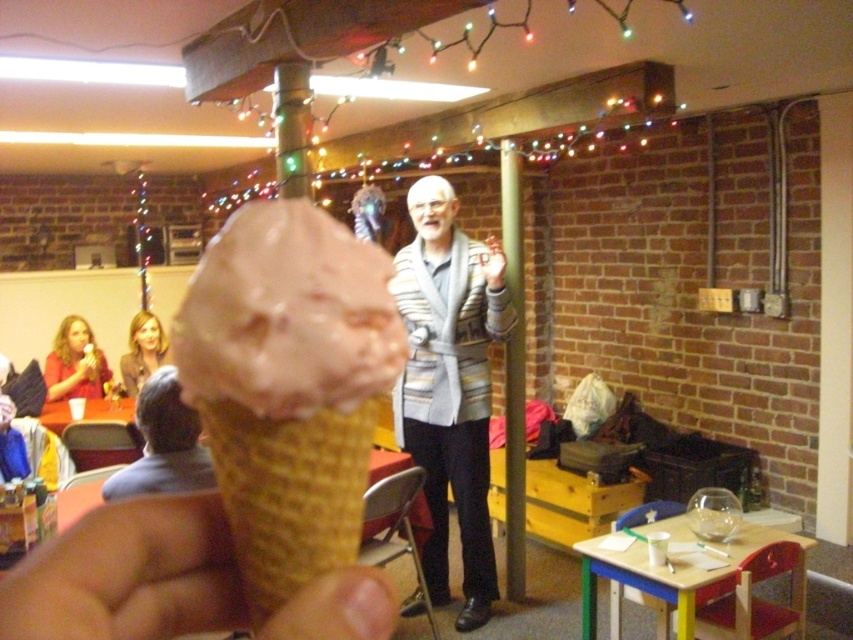
Does striped sweater at center come behind brown hair at left?

That is True.

Is point (428, 484) positioned after point (189, 461)?

Yes.

Describe the element at coordinates (450, 385) in the screenshot. I see `striped sweater at center` at that location.

Where is `striped sweater at center`? striped sweater at center is located at coordinates (450, 385).

The width and height of the screenshot is (853, 640). What do you see at coordinates (163, 444) in the screenshot? I see `brown hair at left` at bounding box center [163, 444].

Is brown hair at left taller than blonde hair at upper left?

Incorrect, brown hair at left's height is not larger of blonde hair at upper left's.

Which is in front, point (194, 419) or point (155, 344)?

Point (194, 419)

This screenshot has width=853, height=640. Identify the location of brown hair at left. (163, 444).

What do you see at coordinates (129, 573) in the screenshot? The width and height of the screenshot is (853, 640). I see `smooth beige cone at lower left` at bounding box center [129, 573].

Which is more to the right, smooth beige cone at lower left or brown hair at left?

Positioned to the right is smooth beige cone at lower left.

Does point (344, 586) come closer to viewer compared to point (164, 472)?

Yes, point (344, 586) is closer to viewer.

Identify the location of smooth beige cone at lower left. (129, 573).